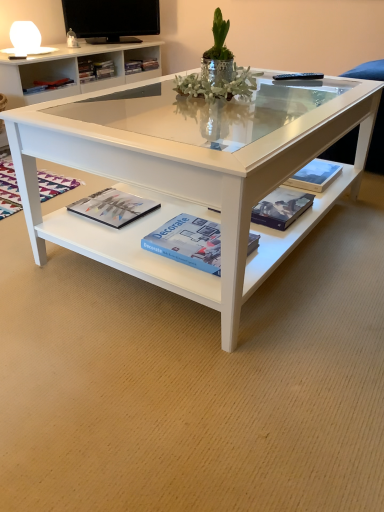
Question: Visually, is blue matte paperback book at center, which ranks as the 2th paperback book in right-to-left order, positioned to the left or to the right of white glossy coffee table at center?

Choices:
 (A) right
 (B) left

Answer: (B)

Question: Considering the positions of point (177, 237) and point (279, 131), is point (177, 237) closer or farther from the camera than point (279, 131)?

Choices:
 (A) closer
 (B) farther

Answer: (B)

Question: Based on their relative distances, which object is farther from the matte black magazine at lower left, which is the 1th magazine in left-to-right order?

Choices:
 (A) black glossy television at upper center
 (B) matte black magazine at lower center, the second magazine viewed from the right
 (C) matte black book at center
 (D) silver metallic vase at center
 (E) white glossy coffee table at center

Answer: (A)

Question: Which is nearer to the silver metallic vase at center?

Choices:
 (A) black glossy television at upper center
 (B) matte black magazine at lower left, which is the 1th magazine in left-to-right order
 (C) white glossy coffee table at center
 (D) hardcover book at center, the 2th paperback book from the left
 (E) matte black magazine at lower center, the second magazine in the left-to-right sequence

Answer: (C)